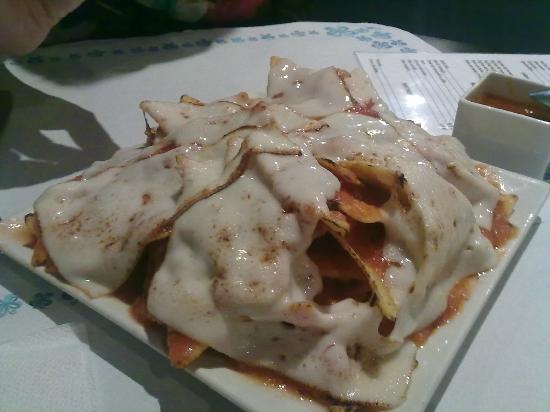
Where is `placemat`? The image size is (550, 412). placemat is located at coordinates (29, 369), (30, 153), (126, 80), (288, 50), (522, 355), (539, 288).